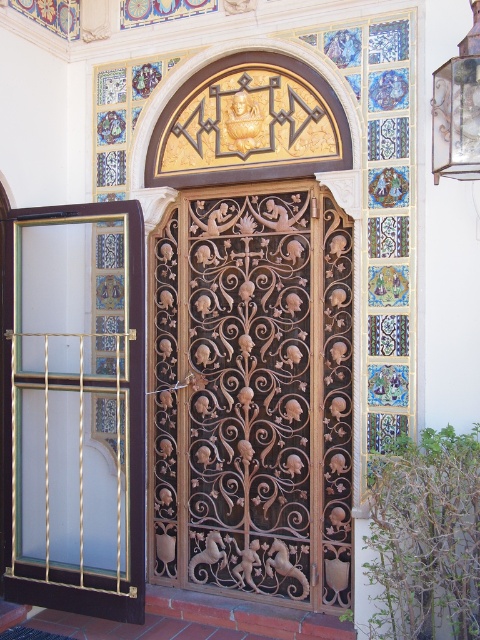
Question: Which of the following is the closest to the observer?

Choices:
 (A) (62, 420)
 (B) (339, 506)

Answer: (B)

Question: From the image, what is the correct spatial relationship of brown wrought iron door at center in relation to frosted glass screen door at left?

Choices:
 (A) below
 (B) above

Answer: (B)

Question: Can you confirm if brown wrought iron door at center is positioned below frosted glass screen door at left?

Choices:
 (A) yes
 (B) no

Answer: (B)

Question: Which object is farther from the camera taking this photo?

Choices:
 (A) frosted glass screen door at left
 (B) brown wrought iron door at center

Answer: (B)

Question: In this image, where is brown wrought iron door at center located relative to frosted glass screen door at left?

Choices:
 (A) below
 (B) above

Answer: (B)